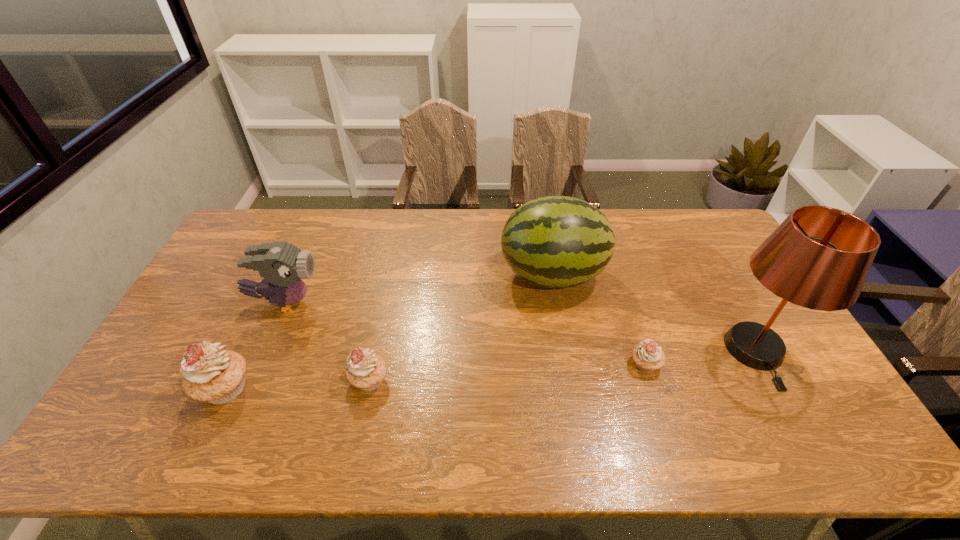
To make them evenly spaced by inserting another cupcake among them, please locate a free space for this new cupcake. Please provide its 2D coordinates. Your answer should be formatted as a tuple, i.e. [(x, y)], where the tuple contains the x and y coordinates of a point satisfying the conditions above.

[(510, 372)]